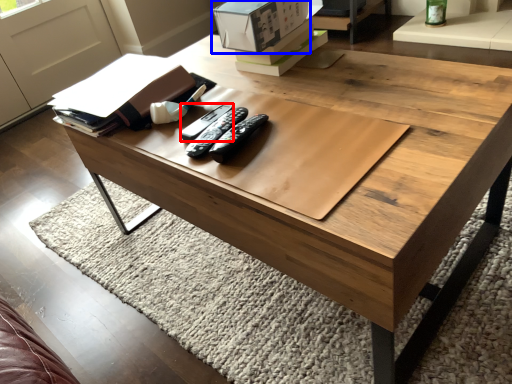
Question: Which of the following is the closest to the observer, remote (highlighted by a red box) or cardboard box (highlighted by a blue box)?

Choices:
 (A) remote
 (B) cardboard box

Answer: (A)